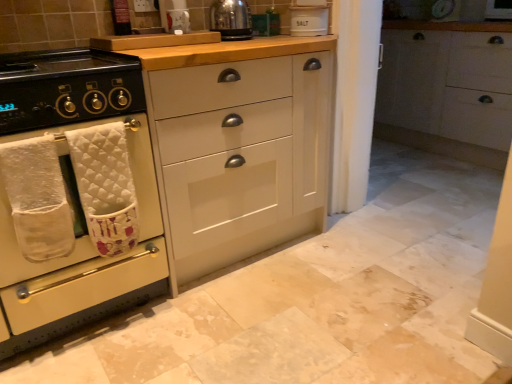
Question: From the image's perspective, is white quilted bath towel at left, the 2th bath towel in the right-to-left sequence, above or below white quilted bath towel at left, positioned as the 2th bath towel in left-to-right order?

Choices:
 (A) below
 (B) above

Answer: (A)

Question: From a real-world perspective, is white quilted bath towel at left, the 2th bath towel in the right-to-left sequence, positioned above or below white quilted bath towel at left, positioned as the 2th bath towel in left-to-right order?

Choices:
 (A) above
 (B) below

Answer: (A)

Question: Estimate the real-world distances between objects in this image. Which object is farther from the shiny metallic kettle at upper center?

Choices:
 (A) black matte gas stove at left
 (B) white quilted bath towel at left, the 1th bath towel from the right
 (C) white ceramic salt container at upper center
 (D) white matte cabinet at right, which is counted as the 1th cabinetry, starting from the right
 (E) white quilted bath towel at left, the 2th bath towel in the right-to-left sequence

Answer: (D)

Question: Estimate the real-world distances between objects in this image. Which object is farther from the white quilted bath towel at left, the 1th bath towel from the right?

Choices:
 (A) black matte gas stove at left
 (B) white quilted bath towel at left, the 2th bath towel in the right-to-left sequence
 (C) shiny metallic kettle at upper center
 (D) white matte cabinet at center, which is the 3th cabinetry in right-to-left order
 (E) white ceramic salt container at upper center

Answer: (E)